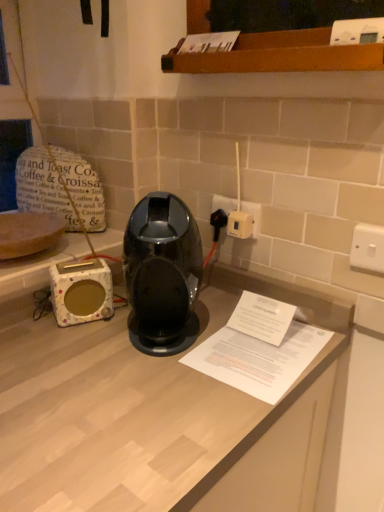
Question: From a real-world perspective, is white plastic switch at upper right, the 2th electric outlet when ordered from left to right, physically located above or below white plastic plug at center-right, acting as the 1th electric outlet starting from the left?

Choices:
 (A) above
 (B) below

Answer: (B)

Question: Is white plastic switch at upper right, the second electric outlet when ordered from back to front, situated inside white plastic plug at center-right, the first electric outlet from the back, or outside?

Choices:
 (A) outside
 (B) inside

Answer: (A)

Question: Considering the real-world distances, which object is closest to the white ceramic toaster at left?

Choices:
 (A) white plastic socket at center-right
 (B) white plastic switch at upper right, the second electric outlet when ordered from back to front
 (C) white paper at center
 (D) glossy plastic coffee machine at center
 (E) wooden shelf at upper center

Answer: (D)

Question: Which of these objects is positioned farthest from the white plastic plug at center-right, acting as the 1th electric outlet starting from the left?

Choices:
 (A) white plastic socket at center-right
 (B) white ceramic toaster at left
 (C) glossy plastic coffee machine at center
 (D) white plastic switch at upper right, the 2th electric outlet when ordered from left to right
 (E) white paper at center

Answer: (B)